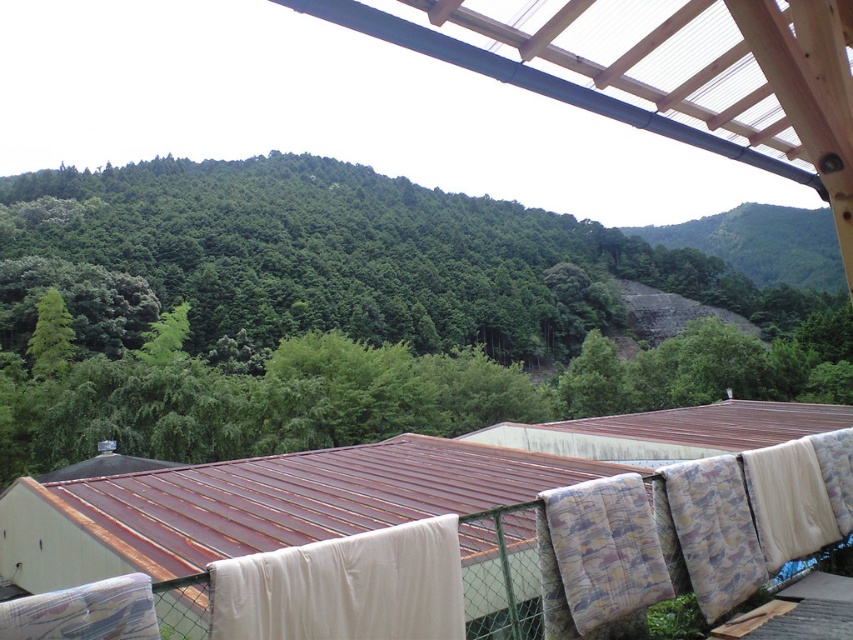
You are standing on the balcony and want to hang a new white fabric at lower center. The green leafy tree at upper center is in the way. Can you hang the fabric without the tree blocking it?

The distance between the green leafy tree at upper center and the white fabric at lower center is 362.45 feet, so the tree is far enough away that it won not block the view of the white fabric at lower center when hung.

You are standing on a balcony and want to hang a new white fabric at lower center. There is already a green leafy tree at upper center in the view. Which object will appear closer to you when you look through the balcony?

The green leafy tree at upper center will appear closer to you because it is further to the viewer than the white fabric at lower center, meaning it is positioned nearer in the visual field.

You are standing on the balcony looking at the scene. There is a point marked at coordinates [352,486]. What object is located at that point?

The rusty metal hut at lower left is located at point [352,486].